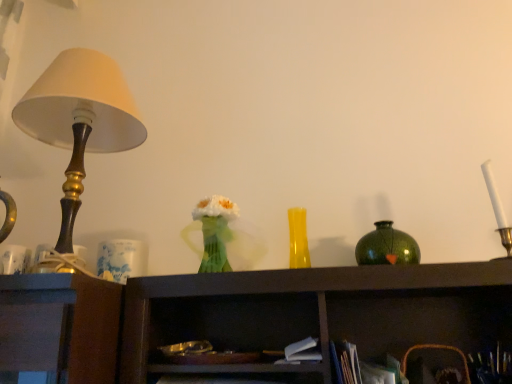
Question: Is translucent green vase at center at the left side of yellow glass vase at center, which is counted as the first vase, starting from the left?

Choices:
 (A) yes
 (B) no

Answer: (A)

Question: Does translucent green vase at center have a lesser height compared to yellow glass vase at center, which is the 2th vase from right to left?

Choices:
 (A) yes
 (B) no

Answer: (B)

Question: From the image's perspective, would you say translucent green vase at center is shown under yellow glass vase at center, which is the 2th vase from right to left?

Choices:
 (A) yes
 (B) no

Answer: (B)

Question: Is translucent green vase at center outside yellow glass vase at center, which is the 2th vase from right to left?

Choices:
 (A) yes
 (B) no

Answer: (A)

Question: Is translucent green vase at center placed right next to yellow glass vase at center, which is the 2th vase from right to left?

Choices:
 (A) no
 (B) yes

Answer: (A)

Question: Is translucent green vase at center in front of yellow glass vase at center, which is counted as the first vase, starting from the left?

Choices:
 (A) yes
 (B) no

Answer: (A)

Question: Is yellow glass vase at center, which is counted as the first vase, starting from the left, beside green speckled vase at upper right, the 1th vase positioned from the right?

Choices:
 (A) yes
 (B) no

Answer: (B)

Question: Is yellow glass vase at center, which is counted as the first vase, starting from the left, positioned behind green speckled vase at upper right, the 1th vase positioned from the right?

Choices:
 (A) yes
 (B) no

Answer: (A)

Question: Can we say yellow glass vase at center, which is counted as the first vase, starting from the left, lies outside green speckled vase at upper right, the 1th vase positioned from the right?

Choices:
 (A) no
 (B) yes

Answer: (B)

Question: From the image's perspective, is yellow glass vase at center, which is the 2th vase from right to left, located beneath green speckled vase at upper right, the 1th vase positioned from the right?

Choices:
 (A) no
 (B) yes

Answer: (A)

Question: Would you say green speckled vase at upper right, the second vase when ordered from left to right, is part of yellow glass vase at center, which is counted as the first vase, starting from the left,'s contents?

Choices:
 (A) yes
 (B) no

Answer: (B)

Question: Is yellow glass vase at center, which is the 2th vase from right to left, turned away from green speckled vase at upper right, the 1th vase positioned from the right?

Choices:
 (A) no
 (B) yes

Answer: (A)

Question: Does yellow glass vase at center, which is the 2th vase from right to left, have a smaller size compared to translucent green vase at center?

Choices:
 (A) no
 (B) yes

Answer: (B)